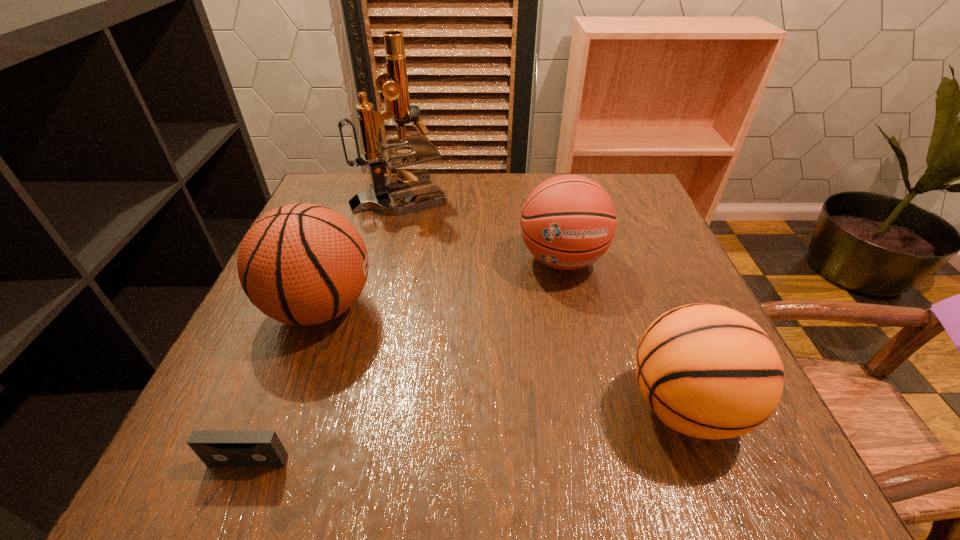
In the image, there is a desktop. Identify the location of blank space at the right edge. Image resolution: width=960 pixels, height=540 pixels. coord(623,312).

In the image, there is a desktop. Where is `vacant space at the far right corner`? This screenshot has height=540, width=960. vacant space at the far right corner is located at coordinates (622, 183).

Where is `free space at the near right corner of the desktop`? The height and width of the screenshot is (540, 960). free space at the near right corner of the desktop is located at coordinates (754, 436).

Identify the location of vacant space in between the nearest basketball and the videotape. This screenshot has width=960, height=540. (467, 433).

Find the location of a particular element. empty space that is in between the microscope and the nearest basketball is located at coordinates (542, 300).

Where is `vacant area that lies between the microscope and the shortest object`? vacant area that lies between the microscope and the shortest object is located at coordinates (324, 328).

The height and width of the screenshot is (540, 960). Identify the location of vacant space in between the leftmost basketball and the nearest basketball. (502, 356).

Find the location of a particular element. The width and height of the screenshot is (960, 540). vacant point located between the nearest basketball and the leftmost basketball is located at coordinates click(502, 356).

Identify which object is the nearest to the shortest object. Please provide its 2D coordinates. Your answer should be formatted as a tuple, i.e. [(x, y)], where the tuple contains the x and y coordinates of a point satisfying the conditions above.

[(304, 264)]

Identify the location of object that ranks as the fourth closest to the leftmost basketball. (708, 371).